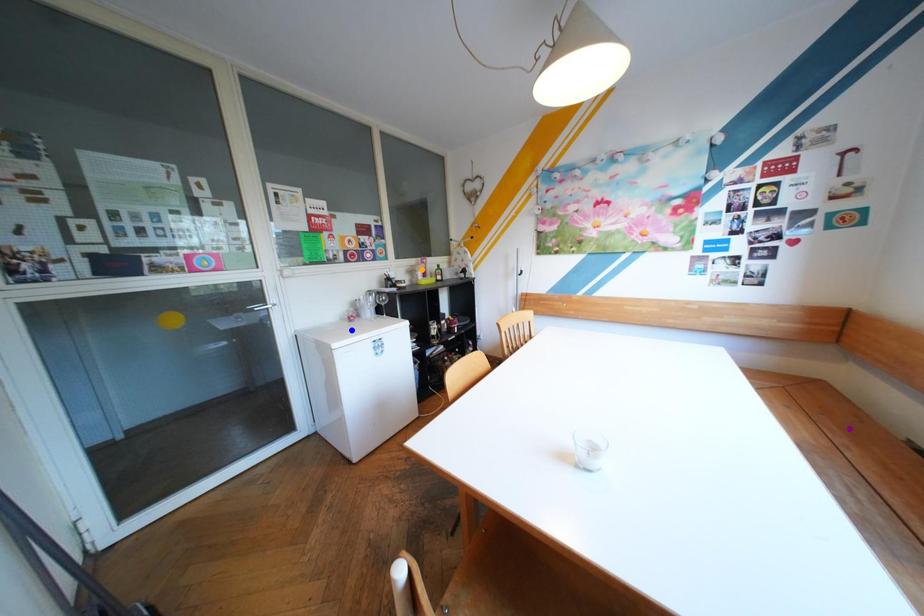
Order these from nearest to farthest:
blue point | purple point | orange point

1. purple point
2. blue point
3. orange point